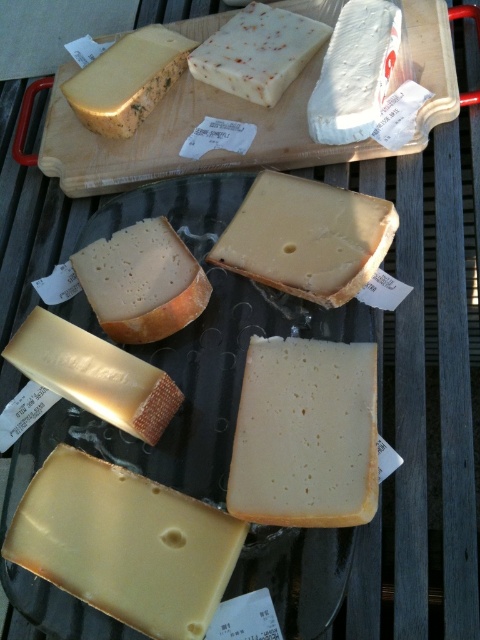
Question: Estimate the real-world distances between objects in this image. Which object is closer to the yellowish matte cheese at lower left?

Choices:
 (A) golden hard cheese at upper left
 (B) white crumbly cheese at upper center
 (C) yellow semi-hard cheese at center
 (D) hard cheese at center

Answer: (D)

Question: From the image, what is the correct spatial relationship of yellowish semi-hard cheese at center in relation to yellowish matte cheese at center-left?

Choices:
 (A) below
 (B) above

Answer: (A)

Question: Is yellowish semi-hard cheese at center further to the viewer compared to white crumbly cheese at upper center?

Choices:
 (A) yes
 (B) no

Answer: (B)

Question: Which of these objects is positioned closest to the yellowish semi-hard cheese at center?

Choices:
 (A) golden hard cheese at upper left
 (B) hard cheese at center
 (C) wooden cutting board at upper center
 (D) yellowish matte cheese at center-left

Answer: (B)

Question: Is hard cheese at center positioned behind golden hard cheese at upper left?

Choices:
 (A) yes
 (B) no

Answer: (B)

Question: Estimate the real-world distances between objects in this image. Which object is farther from the golden hard cheese at upper left?

Choices:
 (A) white crumbly cheese at upper center
 (B) yellowish matte cheese at center-left

Answer: (B)